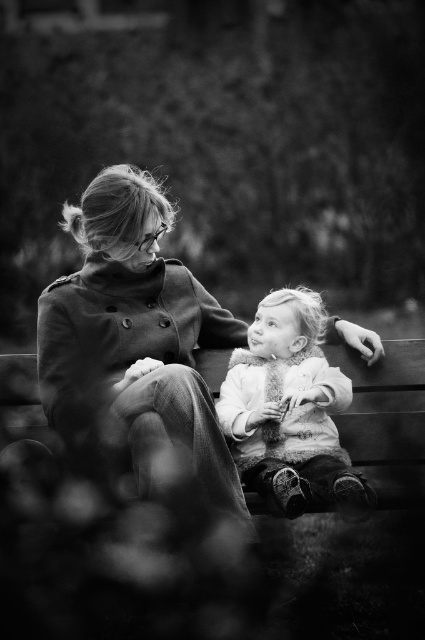
You are a photographer trying to capture the coated fabric coat at center and the fuzzy white coat at center in a single shot. Since both coats are at the center, which one will appear larger in the photo?

The coated fabric coat at center appears larger in the photo because it is closer to the viewer than the fuzzy white coat at center.